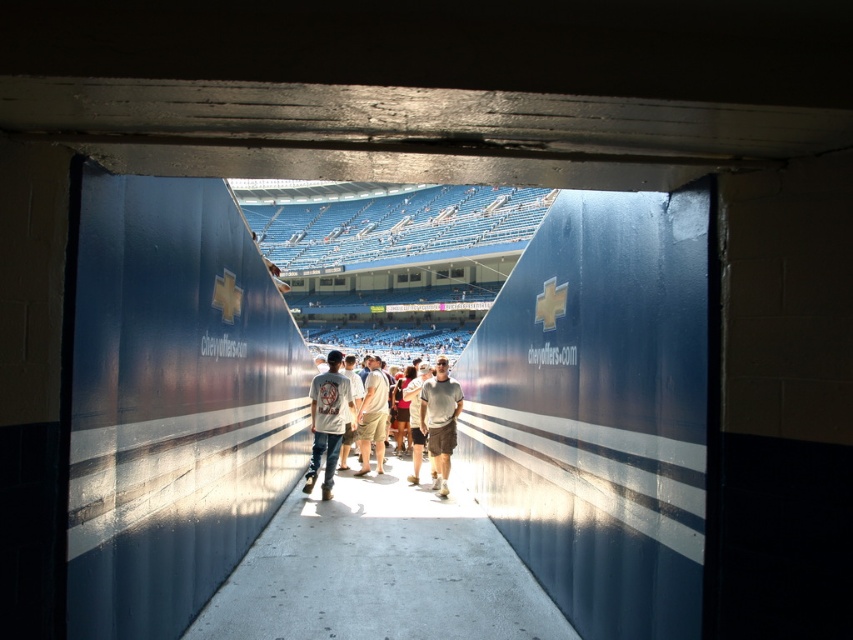
Looking at this image, between light gray cotton t-shirt at center and white cotton t-shirt at center, which one is positioned higher?

Positioned higher is white cotton t-shirt at center.

Where is `light gray cotton t-shirt at center`? light gray cotton t-shirt at center is located at coordinates (437, 417).

Which of these two, light gray cotton t-shirt at center or gray cotton t-shirt at center, stands shorter?

With less height is gray cotton t-shirt at center.

Who is more distant from viewer, [451,428] or [444,369]?

Positioned behind is point [444,369].

The height and width of the screenshot is (640, 853). What do you see at coordinates (437, 417) in the screenshot?
I see `light gray cotton t-shirt at center` at bounding box center [437, 417].

This screenshot has height=640, width=853. Identify the location of light gray cotton t-shirt at center. (437, 417).

You are a GUI agent. You are given a task and a screenshot of the screen. Output one action in this format:
    pyautogui.click(x=<x>, y=<y>)
    Task: Click on the gray cotton t-shirt at center
    
    Given the screenshot: What is the action you would take?
    pyautogui.click(x=440, y=419)

Is gray cotton t-shirt at center behind light brown cotton shorts at center?

No, it is not.

Find the location of a particular element. Image resolution: width=853 pixels, height=640 pixels. gray cotton t-shirt at center is located at coordinates (440, 419).